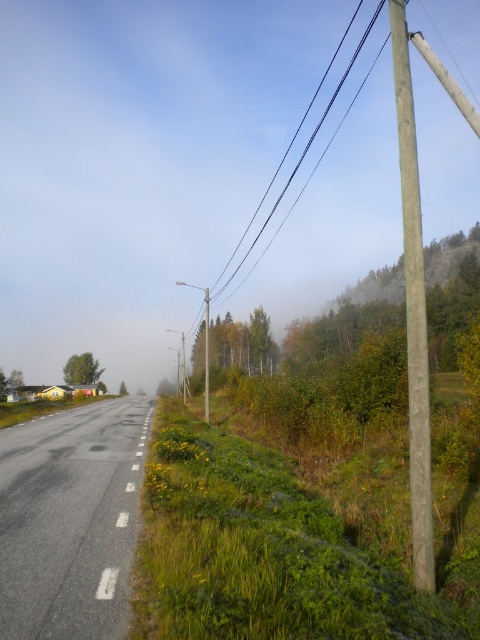
Question: Based on their relative distances, which object is nearer to the smooth gray pole at right?

Choices:
 (A) asphalt road at center
 (B) smooth wire at upper right

Answer: (A)

Question: Observing the image, what is the correct spatial positioning of smooth gray pole at right in reference to smooth wire at upper right?

Choices:
 (A) right
 (B) left

Answer: (B)

Question: Observing the image, what is the correct spatial positioning of asphalt road at center in reference to smooth gray pole at right?

Choices:
 (A) right
 (B) left

Answer: (B)

Question: Which point is closer to the camera?

Choices:
 (A) asphalt road at center
 (B) smooth wire at upper right

Answer: (A)

Question: Is smooth gray pole at right below smooth wire at upper right?

Choices:
 (A) no
 (B) yes

Answer: (B)

Question: Among these points, which one is farthest from the camera?

Choices:
 (A) (357, 51)
 (B) (101, 602)

Answer: (A)